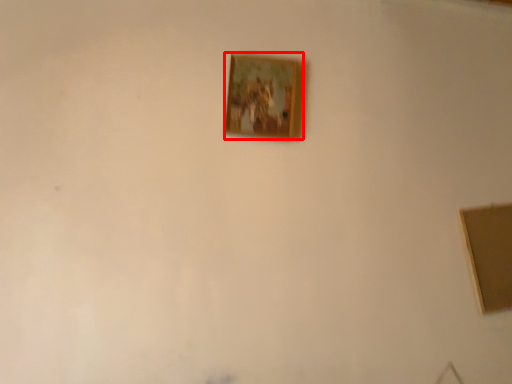
Question: In this image, where is picture frame (annotated by the red box) located relative to picture frame?

Choices:
 (A) left
 (B) right

Answer: (A)